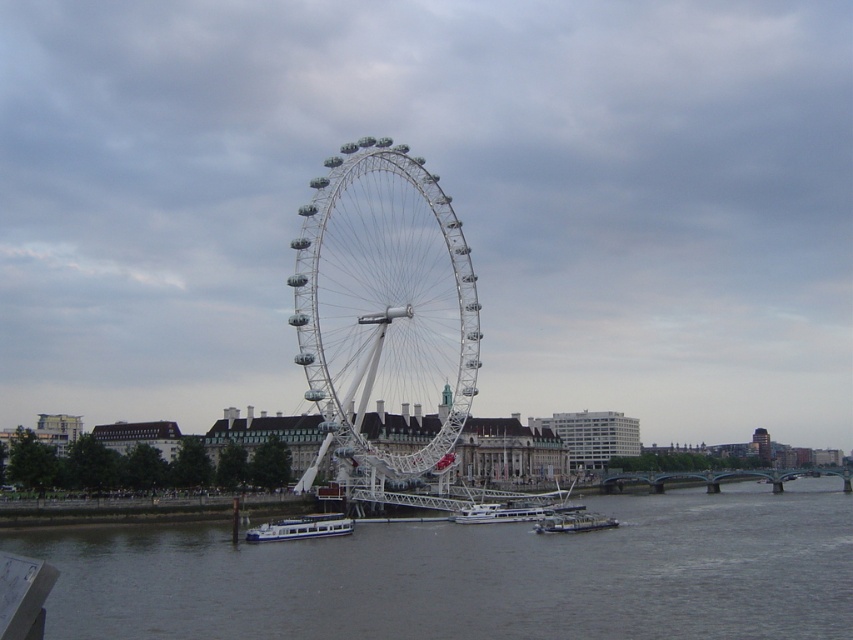
Where is `white metallic ferris wheel at center`? This screenshot has width=853, height=640. white metallic ferris wheel at center is located at coordinates (384, 316).

Does white metallic ferris wheel at center have a greater width compared to metallic gray barge at lower center?

Correct, the width of white metallic ferris wheel at center exceeds that of metallic gray barge at lower center.

Which is in front, point (447, 376) or point (590, 513)?

Point (590, 513)

Where is `white metallic ferris wheel at center`? white metallic ferris wheel at center is located at coordinates (384, 316).

Is white metallic ferris wheel at center bigger than white glossy boat at lower left?

Indeed, white metallic ferris wheel at center has a larger size compared to white glossy boat at lower left.

Is point (434, 452) in front of point (341, 531)?

No, (434, 452) is further to viewer.

Which is in front, point (430, 198) or point (280, 522)?

Point (280, 522) is more forward.

This screenshot has height=640, width=853. Identify the location of white metallic ferris wheel at center. pyautogui.click(x=384, y=316).

Is white glossy boat at lower left to the right of metallic gray barge at lower center from the viewer's perspective?

Incorrect, white glossy boat at lower left is not on the right side of metallic gray barge at lower center.

Who is lower down, white glossy boat at lower left or metallic gray barge at lower center?

Positioned lower is metallic gray barge at lower center.

Describe the element at coordinates (302, 528) in the screenshot. I see `white glossy boat at lower left` at that location.

What are the coordinates of `white glossy boat at lower left` in the screenshot? It's located at (302, 528).